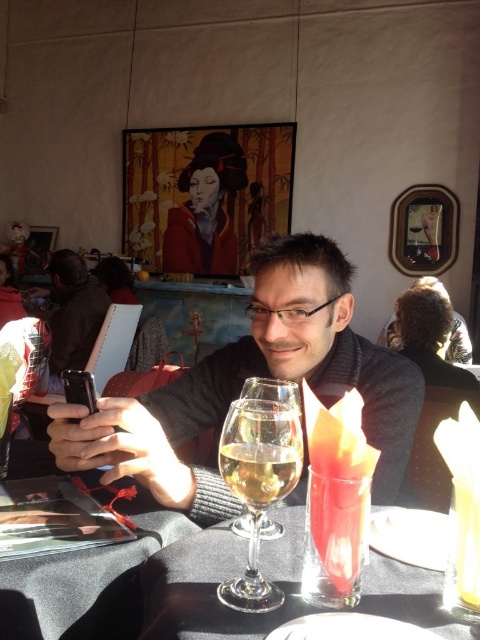
You are a server in a restaurant and need to place a new drink order on the table. The table currently has a clear glass at center and a matte black phone at left. Which object should you move to make space, and why?

You should move the matte black phone at left because it occupies more space than the clear glass at center, according to the description.

You are a waiter in a restaurant. You need to place a small note on the table between the clear glass wine glass at center and the matte black phone at left. Which object should you place the note closer to so that it doesn

The clear glass wine glass at center occupies less space than the matte black phone at left, so placing the note closer to the clear glass wine glass at center would provide more space between the note and the larger matte black phone at left.

You are a server in a restaurant and need to place a new drink order on the table. The customer is seated at the black fabric table at lower left and the translucent glass wine at center is already on the table. Where should you place the new drink to ensure it is closest to the customer without disturbing the existing items?

Place the new drink near the black fabric table at lower left since it is closer to the customer, ensuring it is near them without disturbing the translucent glass wine at center.